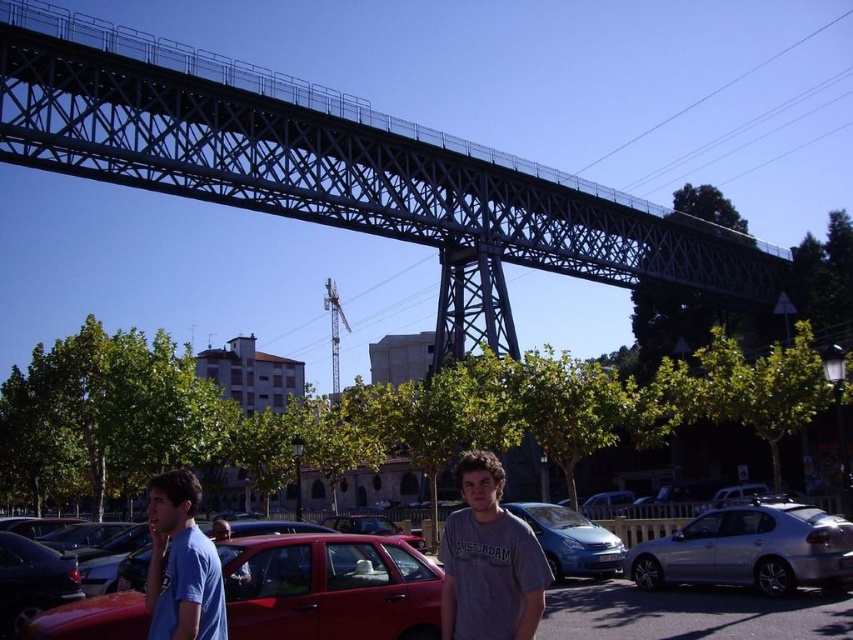
Between point (547, 573) and point (238, 577), which one is positioned in front?

Point (547, 573) is more forward.

Is gray cotton t-shirt at center to the left of blue t-shirt at lower left from the viewer's perspective?

No, gray cotton t-shirt at center is not to the left of blue t-shirt at lower left.

Is point (544, 579) farther from camera compared to point (238, 570)?

No, it is not.

I want to click on gray cotton t-shirt at center, so click(x=489, y=561).

Is point (361, 577) positioned after point (221, 522)?

No, it is in front of (221, 522).

In the scene shown: Who is more forward, (421, 602) or (223, 529)?

Point (421, 602) is in front.

What do you see at coordinates (329, 588) in the screenshot? I see `shiny red sedan at lower left` at bounding box center [329, 588].

This screenshot has width=853, height=640. Find the location of `shiny red sedan at lower left`. shiny red sedan at lower left is located at coordinates (329, 588).

Which is more to the right, gray cotton t-shirt at center or blue cotton shirt at lower left?

gray cotton t-shirt at center

Who is positioned more to the left, gray cotton t-shirt at center or blue cotton shirt at lower left?

From the viewer's perspective, blue cotton shirt at lower left appears more on the left side.

What do you see at coordinates (489, 561) in the screenshot? The height and width of the screenshot is (640, 853). I see `gray cotton t-shirt at center` at bounding box center [489, 561].

Find the location of `gray cotton t-shirt at center`. gray cotton t-shirt at center is located at coordinates (489, 561).